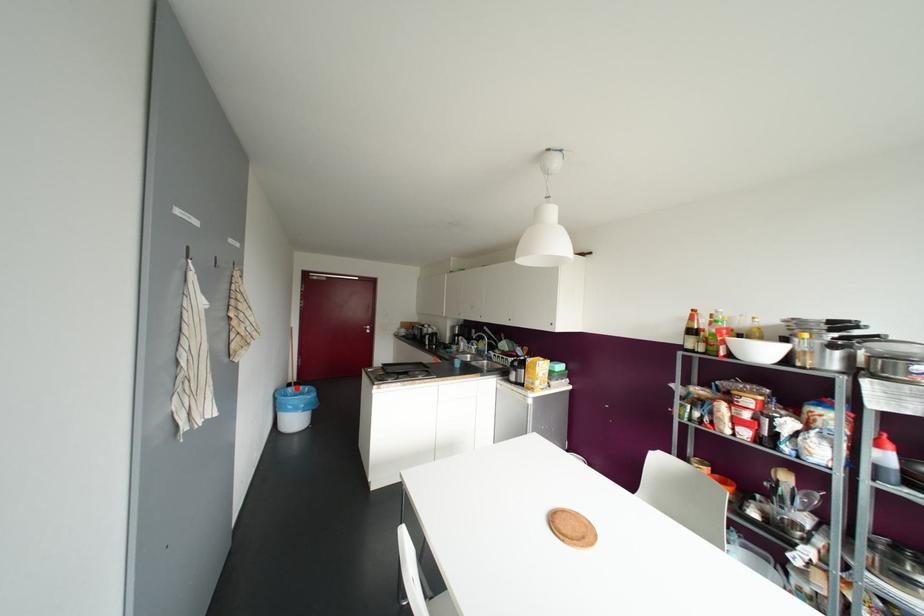
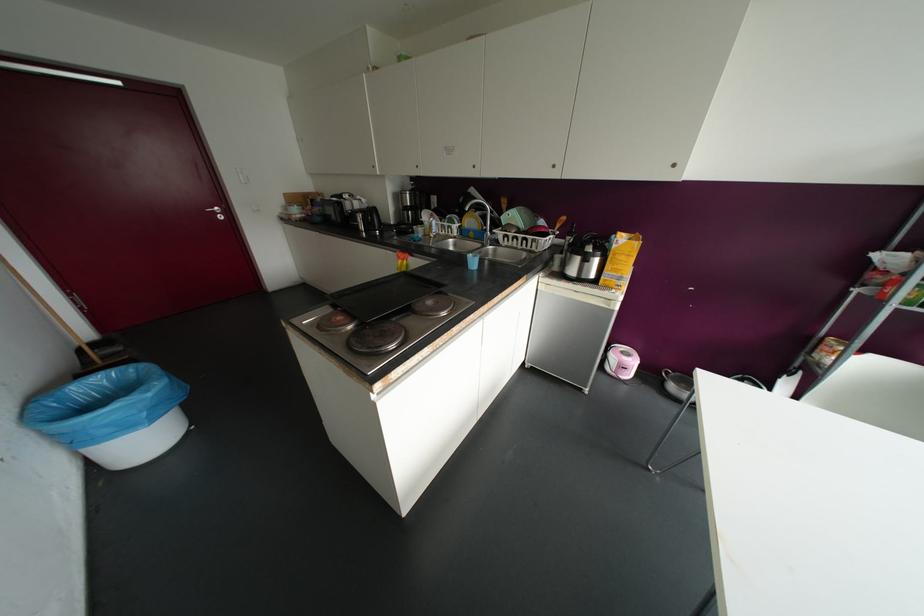
Where in the second image is the point corresponding to the highlighted location from the first image?

(100, 379)